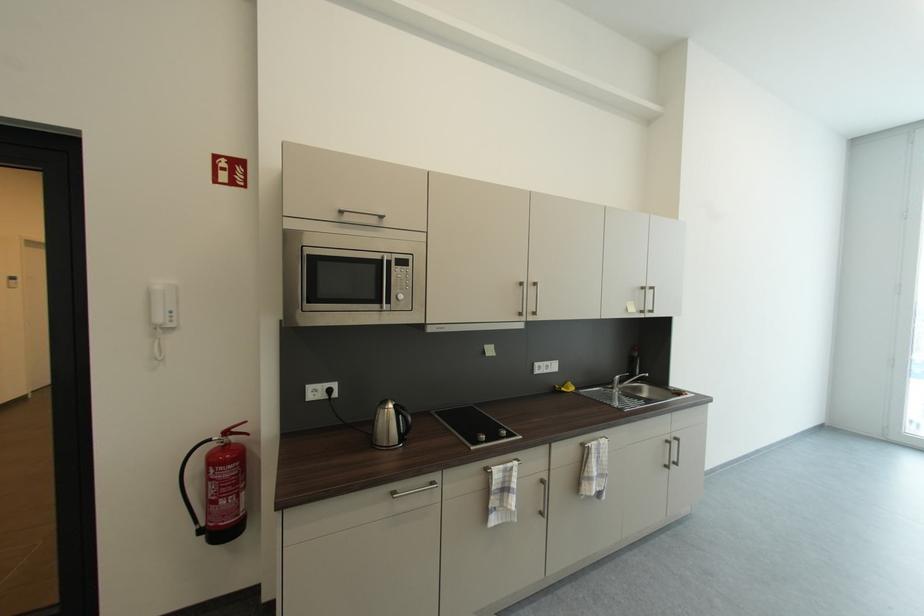
Find where to squeez the yellow sponge. Please return your answer as a coordinate pair (x, y).

(565, 387)